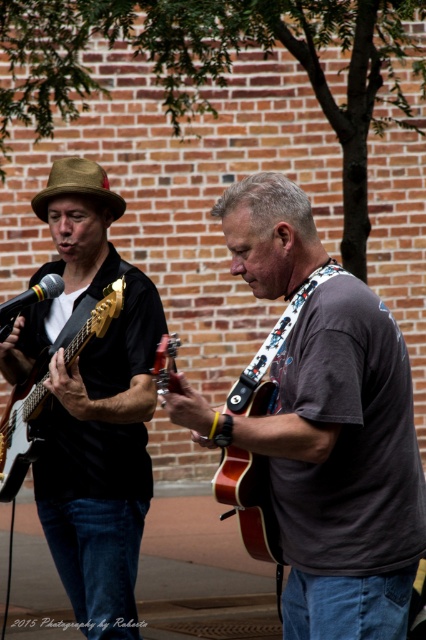
Question: Does wooden acoustic guitar at center appear on the left side of glossy wood guitar at left?

Choices:
 (A) yes
 (B) no

Answer: (B)

Question: Can you confirm if wooden acoustic guitar at center is smaller than glossy wood guitar at left?

Choices:
 (A) yes
 (B) no

Answer: (A)

Question: Which of the following is the farthest from the observer?

Choices:
 (A) matte brown guitar at center
 (B) black matte microphone at left
 (C) brown felt cowboy hat at upper left
 (D) wooden acoustic guitar at center

Answer: (C)

Question: Is glossy wood guitar at left thinner than black matte microphone at left?

Choices:
 (A) no
 (B) yes

Answer: (A)

Question: Considering the real-world distances, which object is farthest from the black matte microphone at left?

Choices:
 (A) glossy wood guitar at left
 (B) brown felt cowboy hat at upper left
 (C) wooden acoustic guitar at center

Answer: (C)

Question: Which object is farther from the camera taking this photo?

Choices:
 (A) matte brown guitar at center
 (B) brown felt cowboy hat at upper left

Answer: (B)